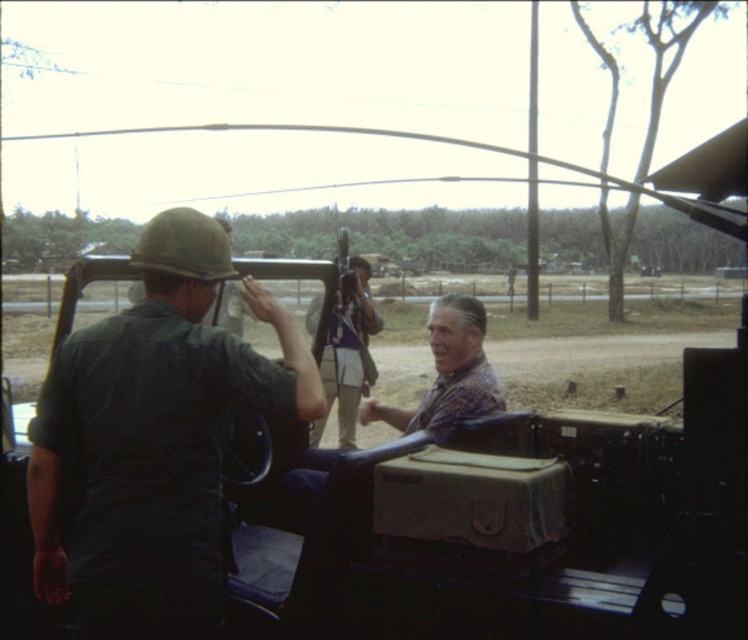
Question: Estimate the real-world distances between objects in this image. Which object is closer to the dark green uniform at left?

Choices:
 (A) camouflage fabric rifle at center
 (B) plaid fabric shirt at center

Answer: (B)

Question: Considering the relative positions of dark green uniform at left and camouflage fabric rifle at center in the image provided, where is dark green uniform at left located with respect to camouflage fabric rifle at center?

Choices:
 (A) above
 (B) below

Answer: (B)

Question: Which object appears farthest from the camera in this image?

Choices:
 (A) camouflage fabric rifle at center
 (B) plaid fabric shirt at center
 (C) dark green uniform at left

Answer: (A)

Question: Is dark green uniform at left behind plaid fabric shirt at center?

Choices:
 (A) yes
 (B) no

Answer: (B)

Question: Which of these objects is positioned closest to the dark green uniform at left?

Choices:
 (A) plaid fabric shirt at center
 (B) camouflage fabric rifle at center

Answer: (A)

Question: Is plaid fabric shirt at center closer to the viewer compared to camouflage fabric rifle at center?

Choices:
 (A) no
 (B) yes

Answer: (B)